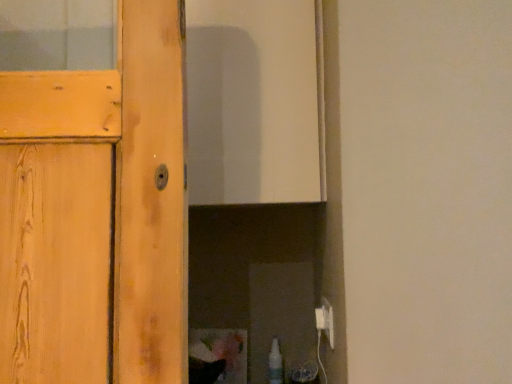
Question: Can you confirm if translucent plastic spray bottle at lower right is shorter than white plastic electric outlet at lower right?

Choices:
 (A) no
 (B) yes

Answer: (A)

Question: Is translucent plastic spray bottle at lower right completely or partially outside of white plastic electric outlet at lower right?

Choices:
 (A) yes
 (B) no

Answer: (A)

Question: From the image's perspective, does translucent plastic spray bottle at lower right appear higher than white plastic electric outlet at lower right?

Choices:
 (A) no
 (B) yes

Answer: (A)

Question: Is translucent plastic spray bottle at lower right oriented away from white plastic electric outlet at lower right?

Choices:
 (A) no
 (B) yes

Answer: (A)

Question: From a real-world perspective, is translucent plastic spray bottle at lower right over white plastic electric outlet at lower right?

Choices:
 (A) no
 (B) yes

Answer: (A)

Question: Can you confirm if translucent plastic spray bottle at lower right is wider than white plastic electric outlet at lower right?

Choices:
 (A) no
 (B) yes

Answer: (B)

Question: Considering the relative positions of white plastic electric outlet at lower right and translucent plastic spray bottle at lower right in the image provided, is white plastic electric outlet at lower right to the right of translucent plastic spray bottle at lower right from the viewer's perspective?

Choices:
 (A) yes
 (B) no

Answer: (A)

Question: Is there a large distance between white plastic electric outlet at lower right and translucent plastic spray bottle at lower right?

Choices:
 (A) no
 (B) yes

Answer: (A)

Question: From the image's perspective, is white plastic electric outlet at lower right located beneath translucent plastic spray bottle at lower right?

Choices:
 (A) no
 (B) yes

Answer: (A)

Question: From the image's perspective, would you say white plastic electric outlet at lower right is positioned over translucent plastic spray bottle at lower right?

Choices:
 (A) yes
 (B) no

Answer: (A)

Question: From a real-world perspective, is white plastic electric outlet at lower right positioned over translucent plastic spray bottle at lower right based on gravity?

Choices:
 (A) no
 (B) yes

Answer: (B)

Question: Can you confirm if white plastic electric outlet at lower right is bigger than translucent plastic spray bottle at lower right?

Choices:
 (A) yes
 (B) no

Answer: (B)

Question: Is translucent plastic spray bottle at lower right wider or thinner than white plastic electric outlet at lower right?

Choices:
 (A) wide
 (B) thin

Answer: (A)